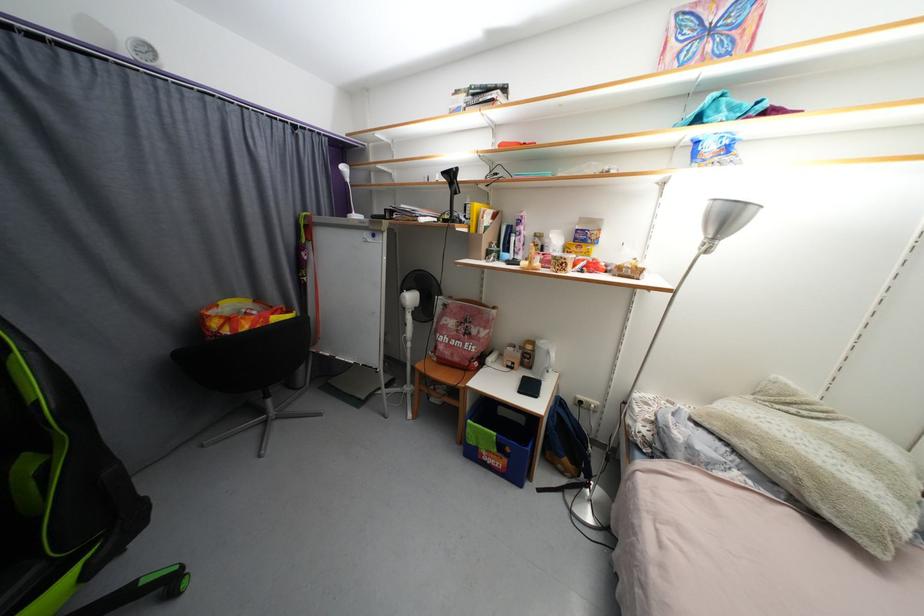
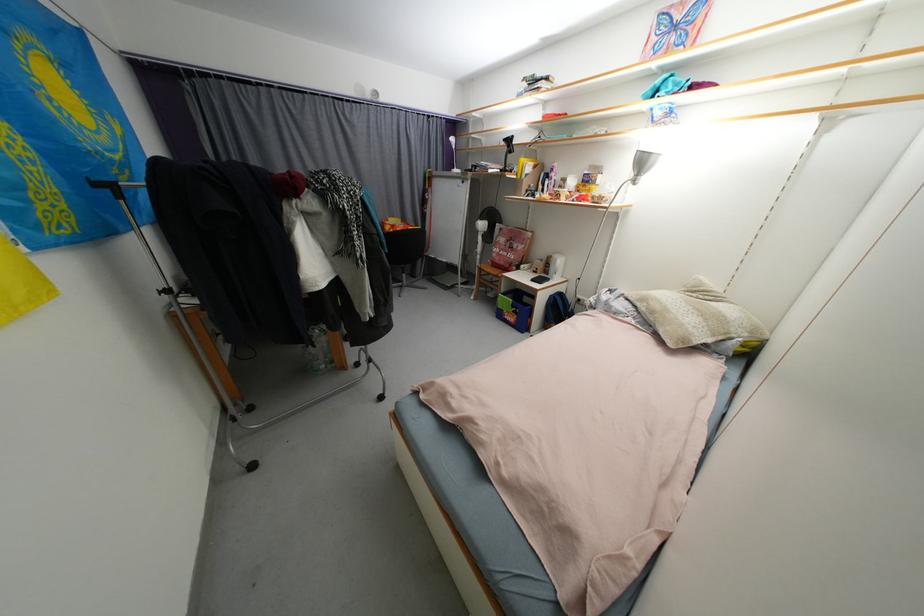
Find the pixel in the second image that matches (732,222) in the first image.

(648, 164)